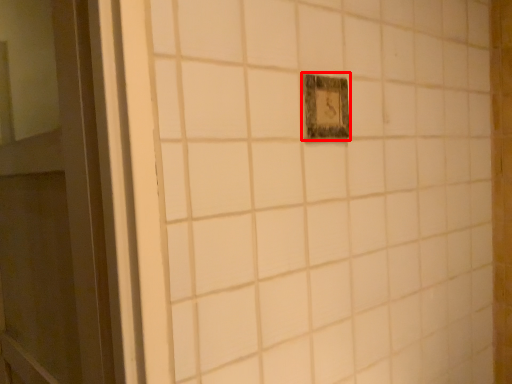
Question: From the image's perspective, where is light switch (annotated by the red box) located relative to door?

Choices:
 (A) below
 (B) above

Answer: (B)